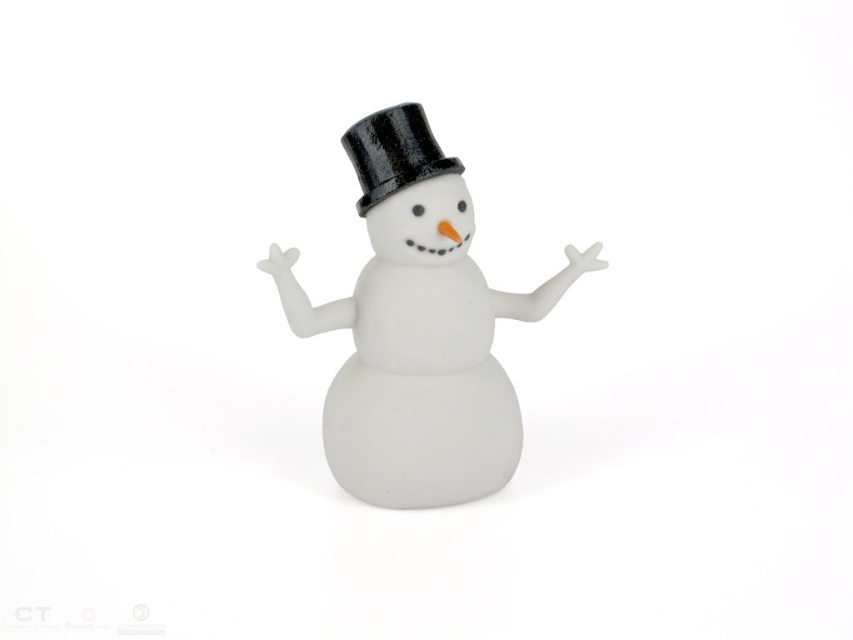
Question: Can you confirm if satin white snowman at center is wider than black glossy dress hat at center?

Choices:
 (A) no
 (B) yes

Answer: (B)

Question: Which object is farther from the camera taking this photo?

Choices:
 (A) black glossy dress hat at center
 (B) satin white snowman at center

Answer: (A)

Question: Which point is farther to the camera?

Choices:
 (A) satin white snowman at center
 (B) black glossy dress hat at center

Answer: (B)

Question: Which of the following is the farthest from the observer?

Choices:
 (A) (430, 138)
 (B) (508, 452)

Answer: (B)

Question: Where is satin white snowman at center located in relation to black glossy dress hat at center in the image?

Choices:
 (A) below
 (B) above

Answer: (A)

Question: Is satin white snowman at center further to camera compared to black glossy dress hat at center?

Choices:
 (A) no
 (B) yes

Answer: (A)